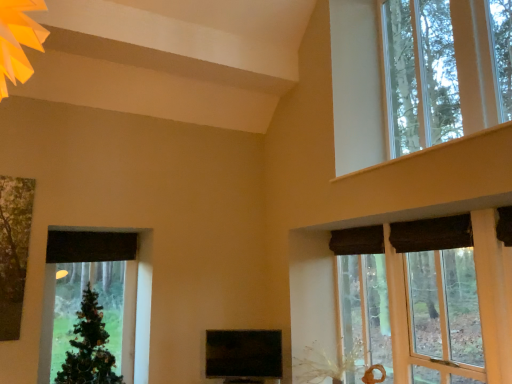
Question: Is green matte christmas tree at left not close to clear glass window at upper right, the first window when ordered from top to bottom?

Choices:
 (A) no
 (B) yes

Answer: (B)

Question: From the image's perspective, is green matte christmas tree at left under clear glass window at upper right, the first window when ordered from top to bottom?

Choices:
 (A) no
 (B) yes

Answer: (B)

Question: From a real-world perspective, is green matte christmas tree at left under clear glass window at upper right, placed as the 2th window when sorted from bottom to top?

Choices:
 (A) yes
 (B) no

Answer: (A)

Question: Does green matte christmas tree at left have a greater height compared to clear glass window at upper right, the first window when ordered from top to bottom?

Choices:
 (A) yes
 (B) no

Answer: (B)

Question: Is green matte christmas tree at left turned away from clear glass window at upper right, placed as the 2th window when sorted from bottom to top?

Choices:
 (A) no
 (B) yes

Answer: (A)

Question: Relative to wooden window frame at upper right, which ranks as the 1th window in bottom-to-top order, is clear glass window at upper right, placed as the 2th window when sorted from bottom to top, in front or behind?

Choices:
 (A) front
 (B) behind

Answer: (B)

Question: From their relative heights in the image, would you say clear glass window at upper right, placed as the 2th window when sorted from bottom to top, is taller or shorter than wooden window frame at upper right, which is counted as the 2th window, starting from the top?

Choices:
 (A) short
 (B) tall

Answer: (B)

Question: In terms of width, does clear glass window at upper right, placed as the 2th window when sorted from bottom to top, look wider or thinner when compared to wooden window frame at upper right, which is counted as the 2th window, starting from the top?

Choices:
 (A) wide
 (B) thin

Answer: (A)

Question: From the image's perspective, relative to wooden window frame at upper right, which is counted as the 2th window, starting from the top, is clear glass window at upper right, placed as the 2th window when sorted from bottom to top, above or below?

Choices:
 (A) above
 (B) below

Answer: (A)

Question: Choose the correct answer: Is clear glass window at upper right, placed as the 2th window when sorted from bottom to top, inside green matte christmas tree at left or outside it?

Choices:
 (A) inside
 (B) outside

Answer: (B)

Question: In the image, is clear glass window at upper right, the first window when ordered from top to bottom, positioned in front of or behind green matte christmas tree at left?

Choices:
 (A) front
 (B) behind

Answer: (A)

Question: Based on their positions, is clear glass window at upper right, placed as the 2th window when sorted from bottom to top, located to the left or right of green matte christmas tree at left?

Choices:
 (A) right
 (B) left

Answer: (A)

Question: Is point tap(484, 69) closer or farther from the camera than point tap(79, 314)?

Choices:
 (A) closer
 (B) farther

Answer: (A)

Question: From the image's perspective, is wooden window frame at upper right, which is counted as the 2th window, starting from the top, positioned above or below clear glass window at upper right, placed as the 2th window when sorted from bottom to top?

Choices:
 (A) below
 (B) above

Answer: (A)

Question: Based on their sizes in the image, would you say wooden window frame at upper right, which ranks as the 1th window in bottom-to-top order, is bigger or smaller than clear glass window at upper right, placed as the 2th window when sorted from bottom to top?

Choices:
 (A) big
 (B) small

Answer: (A)